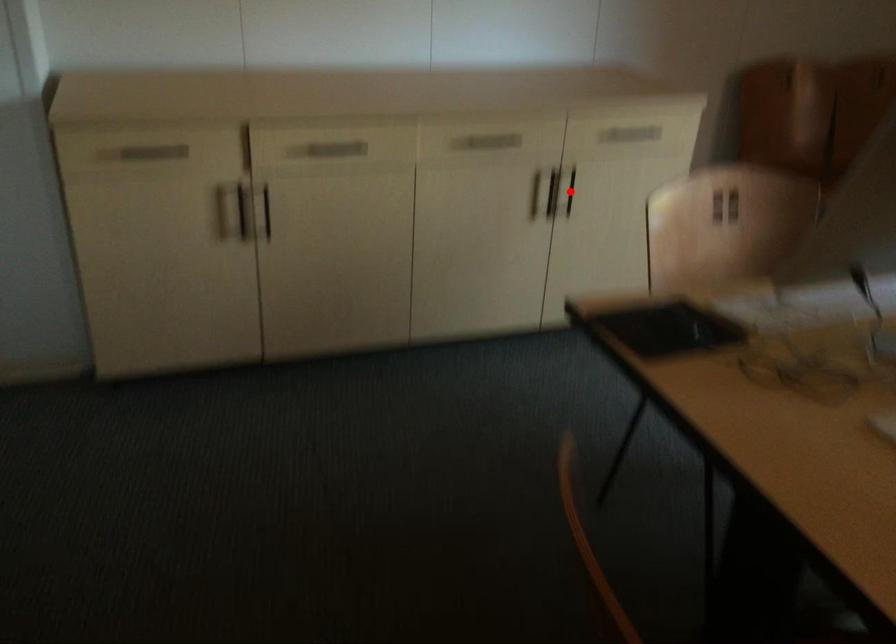
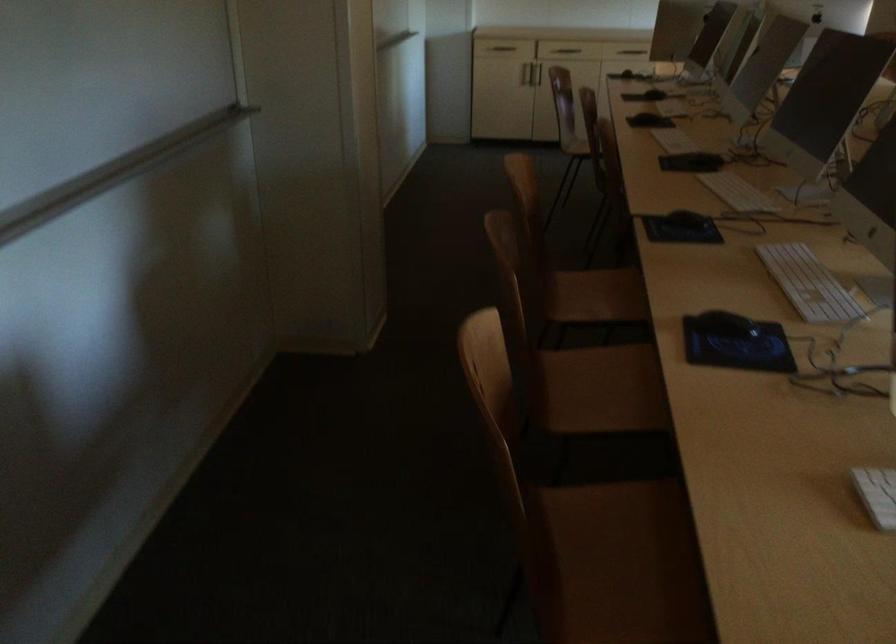
Question: I am providing you with two images of the same scene from different viewpoints. A red point is marked on the first image. Is the red point's position out of view in image 2?

Choices:
 (A) Yes
 (B) No

Answer: (A)